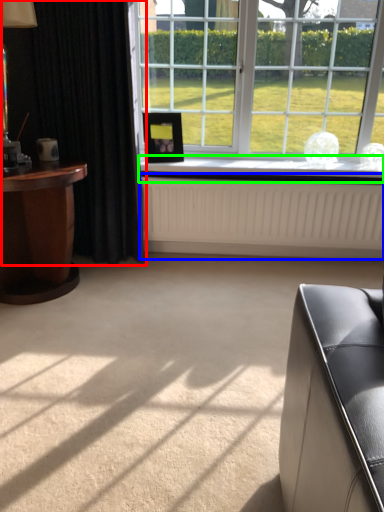
Question: Which object is the farthest from curtain (highlighted by a red box)? Choose among these: radiator (highlighted by a blue box) or window sill (highlighted by a green box).

Choices:
 (A) radiator
 (B) window sill

Answer: (A)